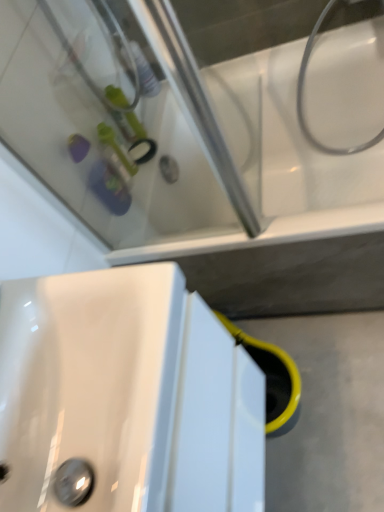
Question: Can we say white glossy hose at upper right lies outside white glossy bathtub at upper center?

Choices:
 (A) yes
 (B) no

Answer: (B)

Question: Does white glossy hose at upper right turn towards white glossy bathtub at upper center?

Choices:
 (A) no
 (B) yes

Answer: (B)

Question: Is white glossy hose at upper right wider than white glossy bathtub at upper center?

Choices:
 (A) yes
 (B) no

Answer: (B)

Question: Is white glossy bathtub at upper center located within white glossy hose at upper right?

Choices:
 (A) no
 (B) yes

Answer: (A)

Question: Is white glossy hose at upper right positioned with its back to white glossy bathtub at upper center?

Choices:
 (A) no
 (B) yes

Answer: (B)

Question: Is point (375, 141) closer or farther from the camera than point (261, 254)?

Choices:
 (A) closer
 (B) farther

Answer: (B)

Question: From the image's perspective, relative to white glossy bathtub at upper center, is white glossy hose at upper right above or below?

Choices:
 (A) above
 (B) below

Answer: (A)

Question: Looking at their shapes, would you say white glossy hose at upper right is wider or thinner than white glossy bathtub at upper center?

Choices:
 (A) wide
 (B) thin

Answer: (B)

Question: Would you say white glossy hose at upper right is to the left or to the right of white glossy bathtub at upper center in the picture?

Choices:
 (A) left
 (B) right

Answer: (B)

Question: Is white glossy bathtub at upper center to the left or to the right of white glossy sink at lower left in the image?

Choices:
 (A) left
 (B) right

Answer: (B)

Question: In terms of width, does white glossy bathtub at upper center look wider or thinner when compared to white glossy sink at lower left?

Choices:
 (A) wide
 (B) thin

Answer: (A)

Question: Which is correct: white glossy bathtub at upper center is inside white glossy sink at lower left, or outside of it?

Choices:
 (A) inside
 (B) outside

Answer: (B)

Question: From a real-world perspective, is white glossy bathtub at upper center above or below white glossy sink at lower left?

Choices:
 (A) below
 (B) above

Answer: (A)

Question: Is white glossy sink at lower left bigger or smaller than white glossy hose at upper right?

Choices:
 (A) small
 (B) big

Answer: (B)

Question: From their relative heights in the image, would you say white glossy sink at lower left is taller or shorter than white glossy hose at upper right?

Choices:
 (A) tall
 (B) short

Answer: (B)